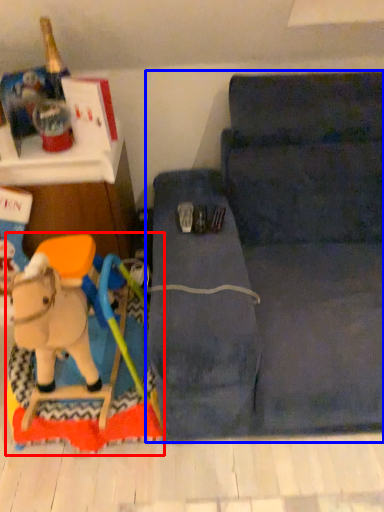
Question: Among these objects, which one is nearest to the camera, toy (highlighted by a red box) or studio couch (highlighted by a blue box)?

Choices:
 (A) toy
 (B) studio couch

Answer: (B)